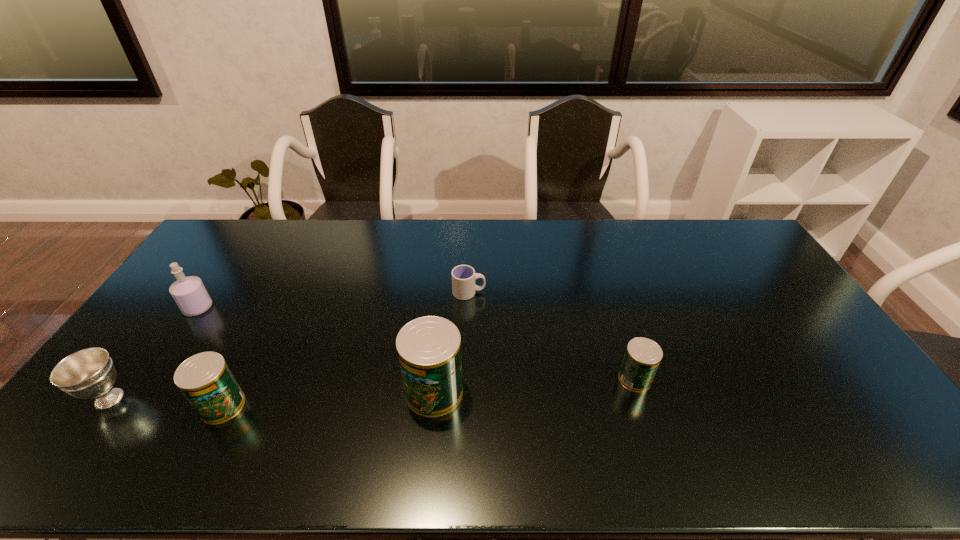
Where is `vacant space at the left edge`? This screenshot has width=960, height=540. vacant space at the left edge is located at coordinates (147, 384).

In order to click on free point at the right edge in this screenshot , I will do `click(788, 343)`.

I want to click on vacant space at the far left corner of the desktop, so click(230, 220).

The height and width of the screenshot is (540, 960). I want to click on free space at the near left corner of the desktop, so click(110, 415).

At what (x,y) coordinates should I click in order to perform the action: click on vacant point at the far right corner. Please return your answer as a coordinate pair (x, y). Looking at the image, I should click on (708, 230).

Identify the location of unoccupied position between the second tallest can and the tallest can. (328, 399).

The width and height of the screenshot is (960, 540). Identify the location of blank region between the chalice and the shortest object. (289, 346).

What are the coordinates of `unoccupied position between the rightmost object and the cup` in the screenshot? It's located at (552, 336).

Image resolution: width=960 pixels, height=540 pixels. In order to click on free spot between the perfume and the second can from right to left in this screenshot , I will do [x=316, y=350].

You are a GUI agent. You are given a task and a screenshot of the screen. Output one action in this format:
    pyautogui.click(x=<x>, y=<y>)
    Task: Click on the free area in between the tallest can and the shortest can
    
    Given the screenshot: What is the action you would take?
    pyautogui.click(x=535, y=385)